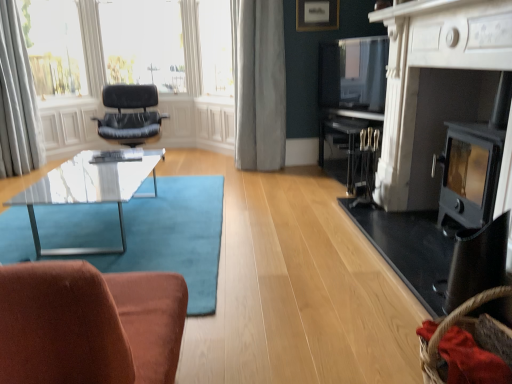
From the picture: Measure the distance between point (482, 0) and camera.

6.27 feet.

This screenshot has height=384, width=512. Describe the element at coordinates (174, 237) in the screenshot. I see `teal carpet at center` at that location.

The image size is (512, 384). Identify the location of matte gold picture frame at upper center. (317, 15).

Considering the relative positions of transparent glass coffee table at lower left and brown woven basket at lower right in the image provided, is transparent glass coffee table at lower left to the right of brown woven basket at lower right from the viewer's perspective?

No.

How far apart are transparent glass coffee table at lower left and brown woven basket at lower right?

A distance of 2.10 meters exists between transparent glass coffee table at lower left and brown woven basket at lower right.

From a real-world perspective, is transparent glass coffee table at lower left located higher than brown woven basket at lower right?

No.

Is transparent glass coffee table at lower left next to brown woven basket at lower right?

No, transparent glass coffee table at lower left is not in contact with brown woven basket at lower right.

From the image's perspective, count 1st fireplaces upward from the brown woven basket at lower right and point to it. Please provide its 2D coordinates.

[(459, 143)]

From a real-world perspective, is black metal fireplace at right, the 1th fireplace in the back-to-front sequence, physically located above or below brown woven basket at lower right?

black metal fireplace at right, the 1th fireplace in the back-to-front sequence, is situated higher than brown woven basket at lower right in the real world.

Consider the image. Measure the distance from black metal fireplace at right, the 1th fireplace in the back-to-front sequence, to brown woven basket at lower right.

black metal fireplace at right, the 1th fireplace in the back-to-front sequence, is 1.32 meters away from brown woven basket at lower right.

Which is more to the right, black metal fireplace at right, the 1th fireplace in the back-to-front sequence, or brown woven basket at lower right?

Positioned to the right is black metal fireplace at right, the 1th fireplace in the back-to-front sequence.

Is point (319, 17) more distant than point (108, 166)?

Yes, point (319, 17) is behind point (108, 166).

Does matte gold picture frame at upper center appear on the left side of transparent glass coffee table at lower left?

Incorrect, matte gold picture frame at upper center is not on the left side of transparent glass coffee table at lower left.

Are matte gold picture frame at upper center and transparent glass coffee table at lower left making contact?

matte gold picture frame at upper center and transparent glass coffee table at lower left are not in contact.

From a real-world perspective, is matte gold picture frame at upper center under transparent glass coffee table at lower left?

No, from a real-world perspective, matte gold picture frame at upper center is not beneath transparent glass coffee table at lower left.

From a real-world perspective, is black metal fireplace at right, the 1th fireplace in the back-to-front sequence, positioned above or below matte black fireplace at right, the second fireplace positioned from the back?

black metal fireplace at right, the 1th fireplace in the back-to-front sequence, is situated lower than matte black fireplace at right, the second fireplace positioned from the back, in the real world.

Is point (475, 100) closer or farther from the camera than point (447, 80)?

Point (475, 100) is farther from the camera than point (447, 80).

Is the position of black metal fireplace at right, the 1th fireplace in the back-to-front sequence, less distant than that of matte black fireplace at right, which is the first fireplace in front-to-back order?

No, black metal fireplace at right, the 1th fireplace in the back-to-front sequence, is further to the viewer.

In the scene shown: Are brown woven basket at lower right and white sheer curtain at upper left, which is the 1th curtain from left to right, beside each other?

brown woven basket at lower right and white sheer curtain at upper left, which is the 1th curtain from left to right, are clearly separated.

From a real-world perspective, is brown woven basket at lower right physically located above or below white sheer curtain at upper left, which is the 1th curtain from left to right?

From a real-world perspective, brown woven basket at lower right is physically below white sheer curtain at upper left, which is the 1th curtain from left to right.

Does point (485, 297) lie behind point (28, 166)?

No.

Would you consider black leather chair at upper left to be distant from clear glass window at upper center?

No, black leather chair at upper left is not far from clear glass window at upper center.

Considering the positions of objects black leather chair at upper left and clear glass window at upper center in the image provided, who is behind, black leather chair at upper left or clear glass window at upper center?

clear glass window at upper center is further away from the camera.

Is black leather chair at upper left bigger than clear glass window at upper center?

Correct, black leather chair at upper left is larger in size than clear glass window at upper center.

What's the angular difference between black leather chair at upper left and teal carpet at center's facing directions?

There is a 175-degree angle between the facing directions of black leather chair at upper left and teal carpet at center.

In the scene shown: How distant is black leather chair at upper left from teal carpet at center?

A distance of 1.88 meters exists between black leather chair at upper left and teal carpet at center.

Where is `mat beneath the black leather chair at upper left (from a real-world perspective)`? The width and height of the screenshot is (512, 384). mat beneath the black leather chair at upper left (from a real-world perspective) is located at coordinates 174,237.

Is the depth of black leather chair at upper left less than that of teal carpet at center?

No, the depth of black leather chair at upper left is greater than that of teal carpet at center.

Find the location of a particular element. The height and width of the screenshot is (384, 512). coffee table that is behind the brown woven basket at lower right is located at coordinates (88, 191).

Where is `basket below the black metal fireplace at right, the 1th fireplace in the back-to-front sequence (from the image's perspective)`? basket below the black metal fireplace at right, the 1th fireplace in the back-to-front sequence (from the image's perspective) is located at coordinates (448, 329).

Estimate the real-world distances between objects in this image. Which object is closer to clear glass window at upper center, gray fabric curtain at center, the 1th curtain positioned from the right, or black metal fireplace at right, the 2th fireplace when ordered from front to back?

gray fabric curtain at center, the 1th curtain positioned from the right, is positioned closer to the anchor clear glass window at upper center.

Considering their positions, is transparent glass coffee table at lower left positioned further to white sheer curtain at upper left, which is the 1th curtain from left to right, than white sheer curtains at upper left?

transparent glass coffee table at lower left is further to white sheer curtain at upper left, which is the 1th curtain from left to right.

When comparing their distances from matte gold picture frame at upper center, does black metal fireplace at right, the 1th fireplace in the back-to-front sequence, or brown woven basket at lower right seem closer?

black metal fireplace at right, the 1th fireplace in the back-to-front sequence, is closer to matte gold picture frame at upper center.

Which object lies further to the anchor point clear glass window at upper center, transparent glass coffee table at lower left or teal carpet at center?

Based on the image, transparent glass coffee table at lower left appears to be further to clear glass window at upper center.

Based on their spatial positions, is gray fabric curtain at center, the 1th curtain positioned from the right, or matte gold picture frame at upper center closer to black metal fireplace at right, the 2th fireplace when ordered from front to back?

Among the two, gray fabric curtain at center, the 1th curtain positioned from the right, is located nearer to black metal fireplace at right, the 2th fireplace when ordered from front to back.

Estimate the real-world distances between objects in this image. Which object is closer to transparent glass coffee table at lower left, black leather chair at upper left or clear glass window at upper center?

Based on the image, black leather chair at upper left appears to be nearer to transparent glass coffee table at lower left.

Looking at the image, which one is located closer to brown woven basket at lower right, white sheer curtain at upper left, the second curtain positioned from the right, or matte black fireplace at right, which is the first fireplace in front-to-back order?

matte black fireplace at right, which is the first fireplace in front-to-back order, is closer to brown woven basket at lower right.

Which object lies nearer to the anchor point clear glass window at upper center, black leather chair at upper left or teal carpet at center?

black leather chair at upper left lies closer to clear glass window at upper center than the other object.

Where is `chair between teal carpet at center and clear glass window at upper center along the z-axis`? chair between teal carpet at center and clear glass window at upper center along the z-axis is located at coordinates (130, 115).

This screenshot has height=384, width=512. I want to click on fireplace between white sheer curtains at upper left and black metal fireplace at right, the 2th fireplace when ordered from front to back, in the horizontal direction, so click(x=440, y=100).

This screenshot has width=512, height=384. I want to click on picture frame situated between black leather chair at upper left and black metal fireplace at right, the 1th fireplace in the back-to-front sequence, from left to right, so click(317, 15).

Locate an element on the screen. window between white sheer curtains at upper left and gray fabric curtain at center, the 2th curtain viewed from the left, in the horizontal direction is located at coordinates (216, 47).